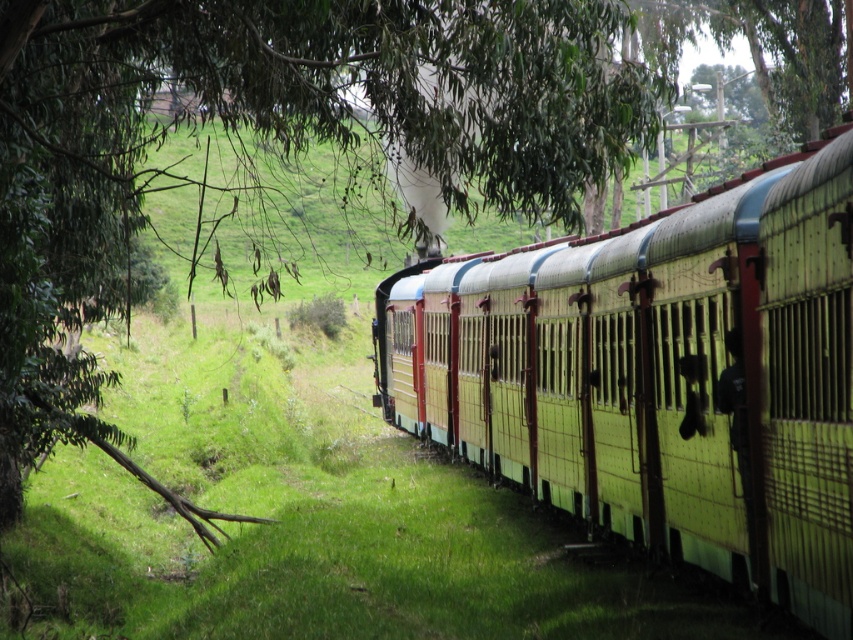
You are a photographer trying to capture the entire yellow painted metal train at center and the green leafy tree at center in one frame. Based on their sizes, which object will appear smaller in the photo?

The yellow painted metal train at center will appear smaller in the photo since its width is less than the green leafy tree at center.

You are a photographer trying to capture the yellow painted metal train at center and the green leafy tree at center in a single frame. Based on their sizes, which object should you focus on to ensure both are clearly visible in the photo?

The yellow painted metal train at center has a smaller size compared to green leafy tree at center. To ensure both are clearly visible, focus on the green leafy tree at center since it is larger and will remain in focus while the smaller train can still be captured in the frame.